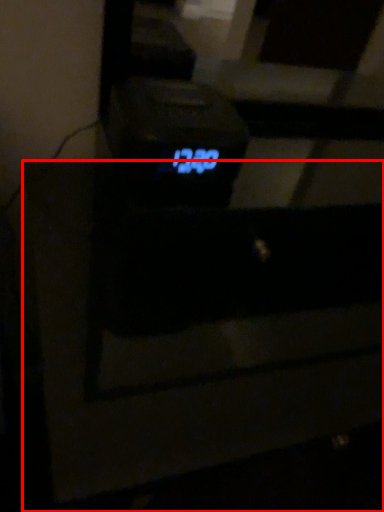
Question: From the image's perspective, where is furniture (annotated by the red box) located in relation to digital clock in the image?

Choices:
 (A) above
 (B) below

Answer: (B)